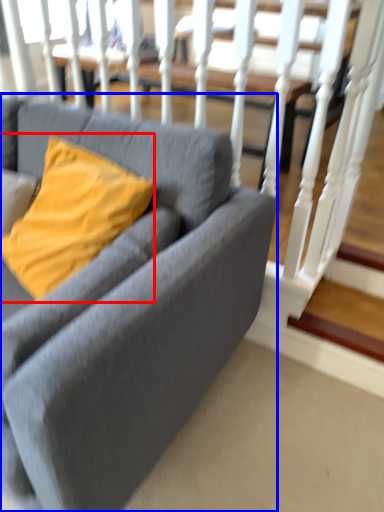
Question: Which of the following is the farthest to the observer, pillow (highlighted by a red box) or studio couch (highlighted by a blue box)?

Choices:
 (A) pillow
 (B) studio couch

Answer: (A)